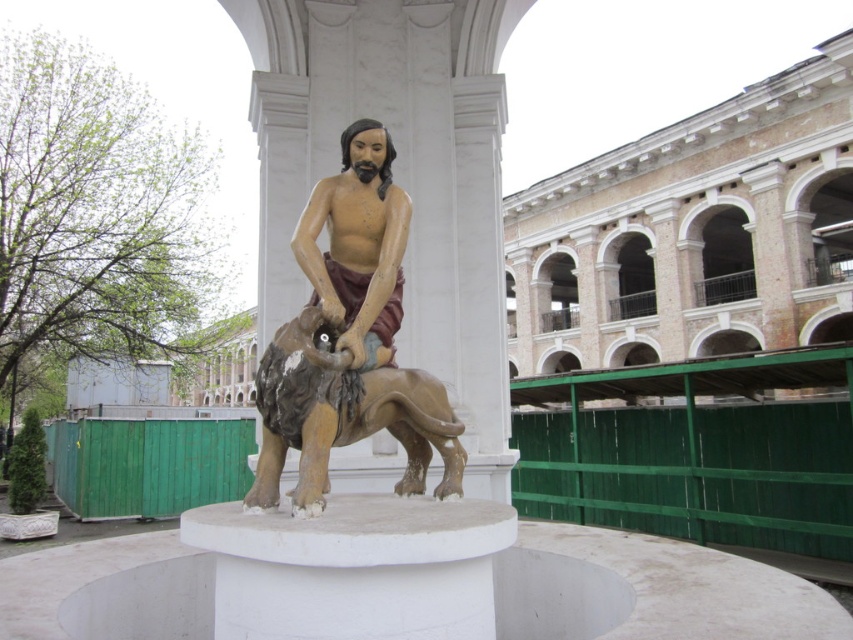
Is wooden statue of man riding animal at center taller than matte wood statue at center?

Correct, wooden statue of man riding animal at center is much taller as matte wood statue at center.

Is wooden statue of man riding animal at center to the right of matte wood statue at center from the viewer's perspective?

Indeed, wooden statue of man riding animal at center is positioned on the right side of matte wood statue at center.

Between point (294, 429) and point (335, 344), which one is positioned behind?

The point (335, 344) is more distant.

The image size is (853, 640). Find the location of `wooden statue of man riding animal at center`. wooden statue of man riding animal at center is located at coordinates (352, 339).